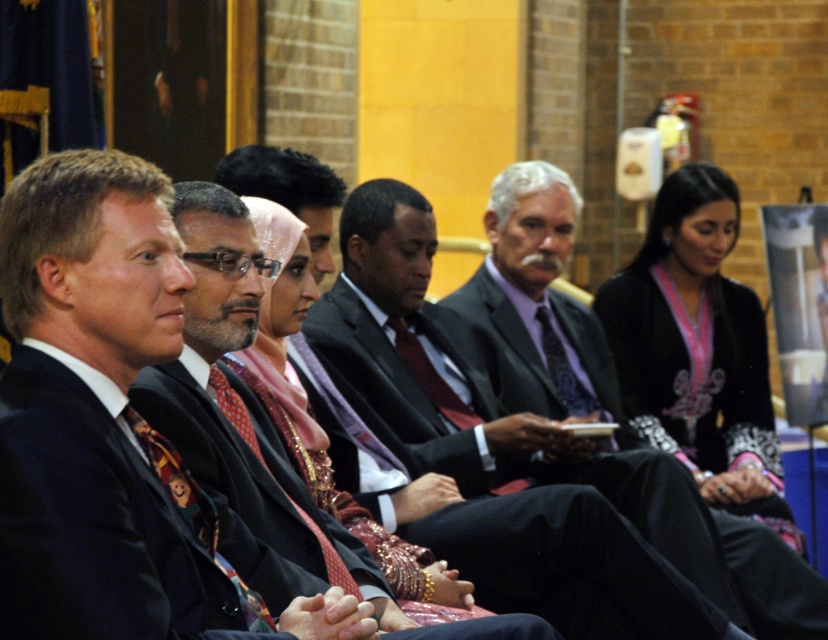
You are an event planner trying to place a name tag on the black satin suit at center. The name tag needs to be placed at coordinates between 0.75 and 0.85 on the x and y axes. Can you place it there?

The black satin suit at center is located at point (94,524). Since the y coordinate 0.114 is below the required minimum of 0.75, the name tag cannot be placed within the specified coordinates.

You are an event planner arranging seating for a formal event. You notice two black suits at the center of the image. Which one is positioned lower between the black satin suit at center and the matte black suit at center?

The black satin suit at center is positioned lower than the matte black suit at center as it is described to be below it.